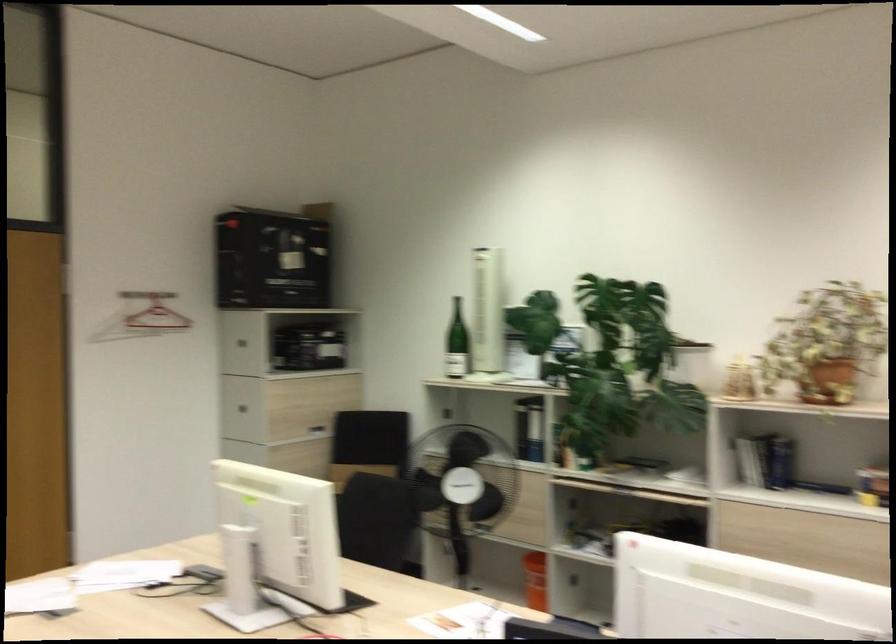
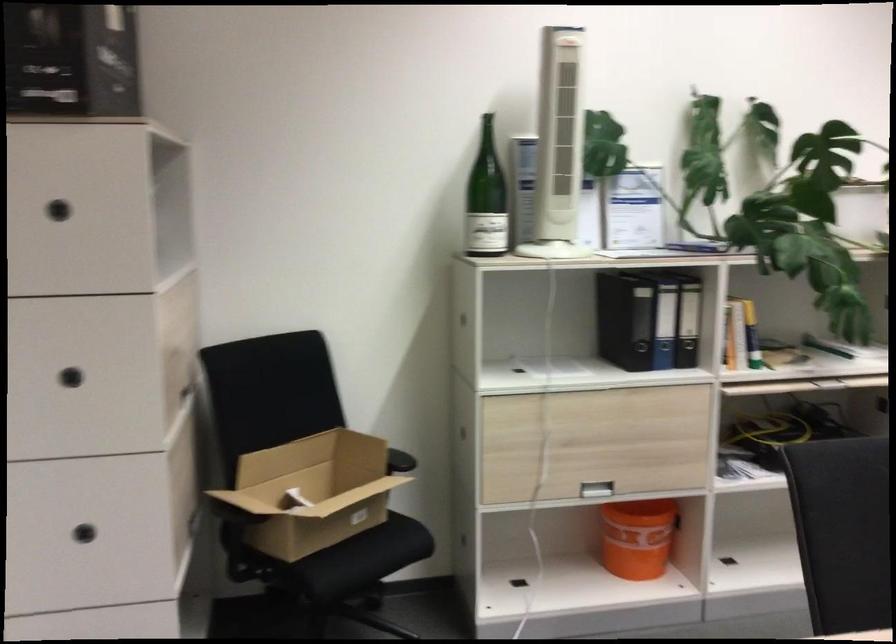
The point at (x=252, y=337) is marked in the first image. Where is the corresponding point in the second image?

(59, 210)